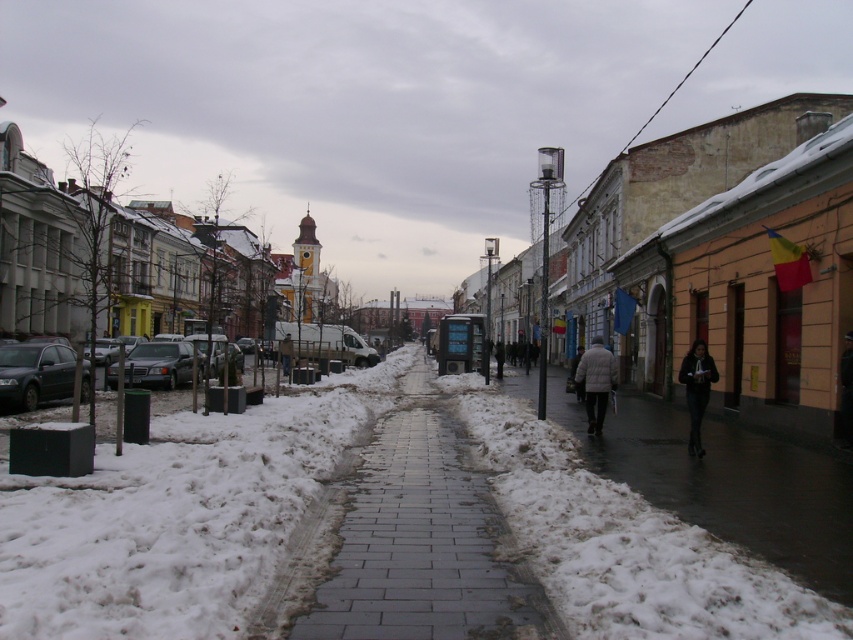
Question: Estimate the real-world distances between objects in this image. Which object is closer to the shiny black sedan at left?

Choices:
 (A) dark gray coat at center
 (B) gray concrete sidewalk at center
 (C) dark gray fabric jacket at lower right

Answer: (B)

Question: Which point is closer to the camera?

Choices:
 (A) (575, 376)
 (B) (61, 368)

Answer: (B)

Question: Considering the relative positions of gray concrete sidewalk at center and matte black car at left in the image provided, where is gray concrete sidewalk at center located with respect to matte black car at left?

Choices:
 (A) below
 (B) above

Answer: (A)

Question: Can you confirm if white powdery snow at lower left is positioned to the right of shiny black sedan at left?

Choices:
 (A) no
 (B) yes

Answer: (B)

Question: Can you confirm if gray concrete sidewalk at center is wider than dark gray concrete sidewalk at lower right?

Choices:
 (A) no
 (B) yes

Answer: (A)

Question: Which object is farther from the camera taking this photo?

Choices:
 (A) shiny black sedan at left
 (B) gray concrete sidewalk at center
 (C) dark gray coat at center

Answer: (C)